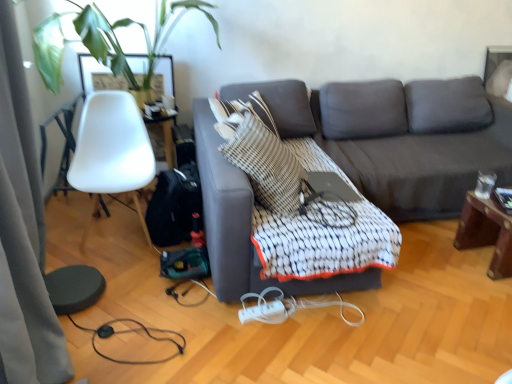
Question: Is the position of mahogany wood side table at right more distant than that of white textured quilt at center?

Choices:
 (A) yes
 (B) no

Answer: (A)

Question: Considering the relative positions of mahogany wood side table at right and white textured quilt at center in the image provided, is mahogany wood side table at right to the left of white textured quilt at center from the viewer's perspective?

Choices:
 (A) yes
 (B) no

Answer: (B)

Question: Is white textured quilt at center inside mahogany wood side table at right?

Choices:
 (A) yes
 (B) no

Answer: (B)

Question: Does mahogany wood side table at right have a smaller size compared to white textured quilt at center?

Choices:
 (A) no
 (B) yes

Answer: (B)

Question: Does mahogany wood side table at right have a greater width compared to white textured quilt at center?

Choices:
 (A) yes
 (B) no

Answer: (B)

Question: Is mahogany wood side table at right next to white textured quilt at center and touching it?

Choices:
 (A) yes
 (B) no

Answer: (B)

Question: Can you confirm if dark gray fabric couch at center is taller than white textured quilt at center?

Choices:
 (A) yes
 (B) no

Answer: (A)

Question: From the image's perspective, would you say dark gray fabric couch at center is shown under white textured quilt at center?

Choices:
 (A) no
 (B) yes

Answer: (A)

Question: Is dark gray fabric couch at center thinner than white textured quilt at center?

Choices:
 (A) no
 (B) yes

Answer: (A)

Question: Considering the relative positions of dark gray fabric couch at center and white textured quilt at center in the image provided, is dark gray fabric couch at center to the left of white textured quilt at center from the viewer's perspective?

Choices:
 (A) yes
 (B) no

Answer: (B)

Question: Does dark gray fabric couch at center have a lesser height compared to white textured quilt at center?

Choices:
 (A) yes
 (B) no

Answer: (B)

Question: Is the position of dark gray fabric couch at center more distant than that of white textured quilt at center?

Choices:
 (A) no
 (B) yes

Answer: (A)

Question: Does silky gray curtain at left turn towards mahogany wood side table at right?

Choices:
 (A) yes
 (B) no

Answer: (A)